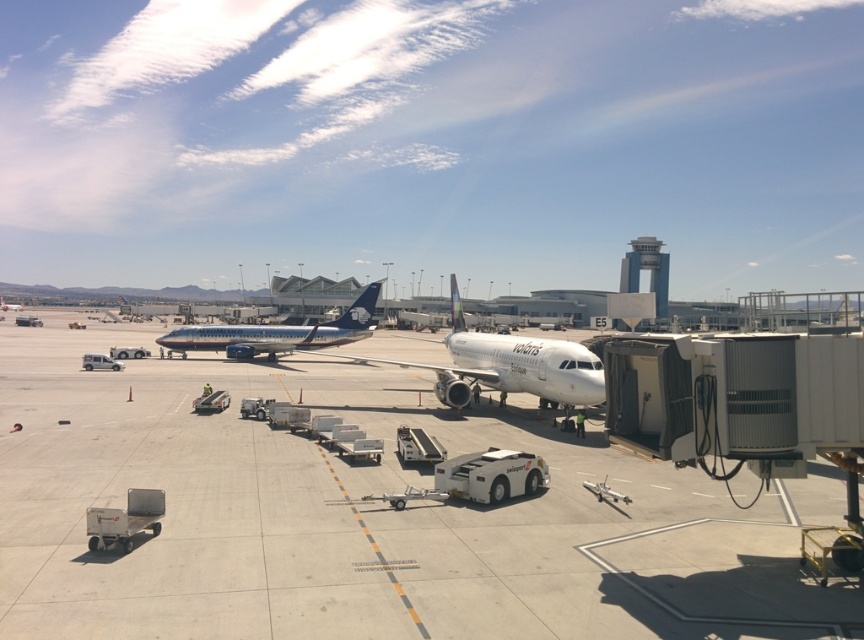
Question: Does white glossy airplane at center have a lesser width compared to blue metallic airplane at center?

Choices:
 (A) yes
 (B) no

Answer: (A)

Question: Where is white smooth tarmac at center located in relation to white glossy airplane at center in the image?

Choices:
 (A) above
 (B) below

Answer: (B)

Question: Which point appears closest to the camera in this image?

Choices:
 (A) (575, 364)
 (B) (213, 340)
 (C) (338, 385)

Answer: (A)

Question: Which of the following is the closest to the observer?

Choices:
 (A) white smooth tarmac at center
 (B) white glossy airplane at center
 (C) blue metallic airplane at center

Answer: (A)

Question: Is white smooth tarmac at center above blue metallic airplane at center?

Choices:
 (A) yes
 (B) no

Answer: (B)

Question: Which of these objects is positioned closest to the white glossy airplane at center?

Choices:
 (A) white smooth tarmac at center
 (B) blue metallic airplane at center

Answer: (A)